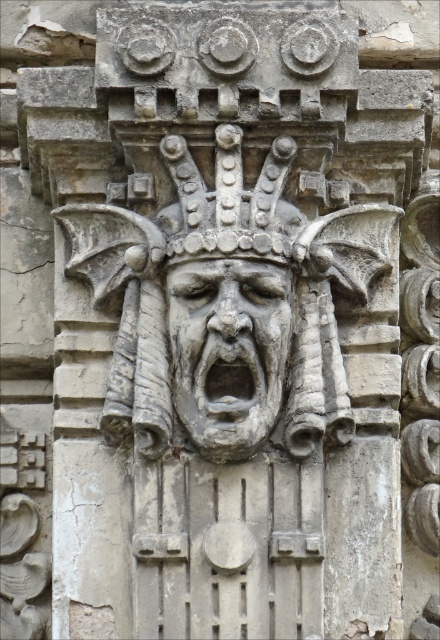
You are an architect examining a historical building. You notice two elements in the carving at the center of the image. One is labeled as the stone carving at center, and the other is the gray stone face at center. From your perspective, which one is positioned to the right?

The stone carving at center is positioned to the right of the gray stone face at center.

You are an architect examining a historical building. You notice two elements in the carving at the center of the image. One is labeled as the stone carving at center and the other as the gray stone face at center. Which of these two elements is located above the other?

The stone carving at center is positioned over the gray stone face at center, meaning the stone carving at center is above the gray stone face at center.

You are an architect examining a stone carving. You see the stone carving at center and the gray stone face at center. Which one is taller?

The stone carving at center is taller than the gray stone face at center.